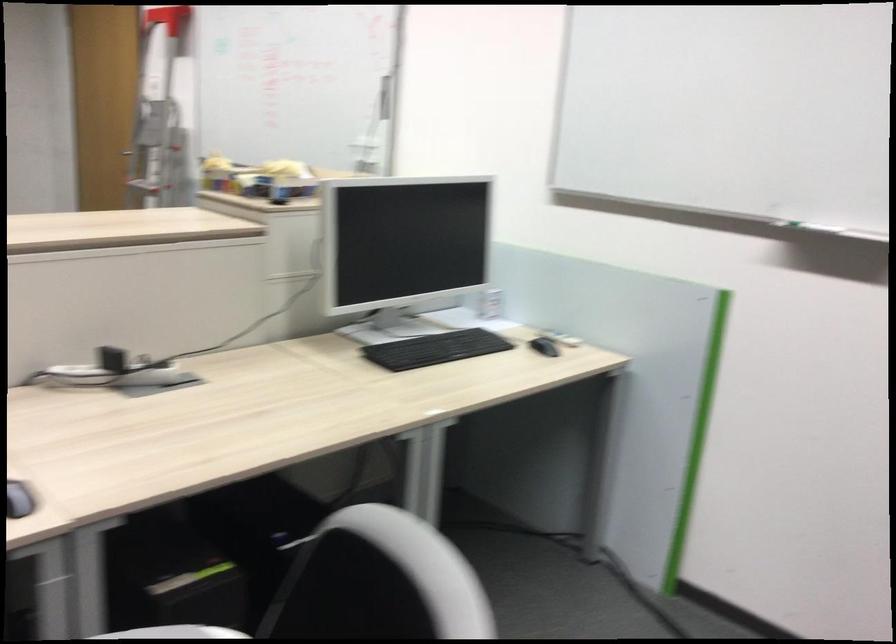
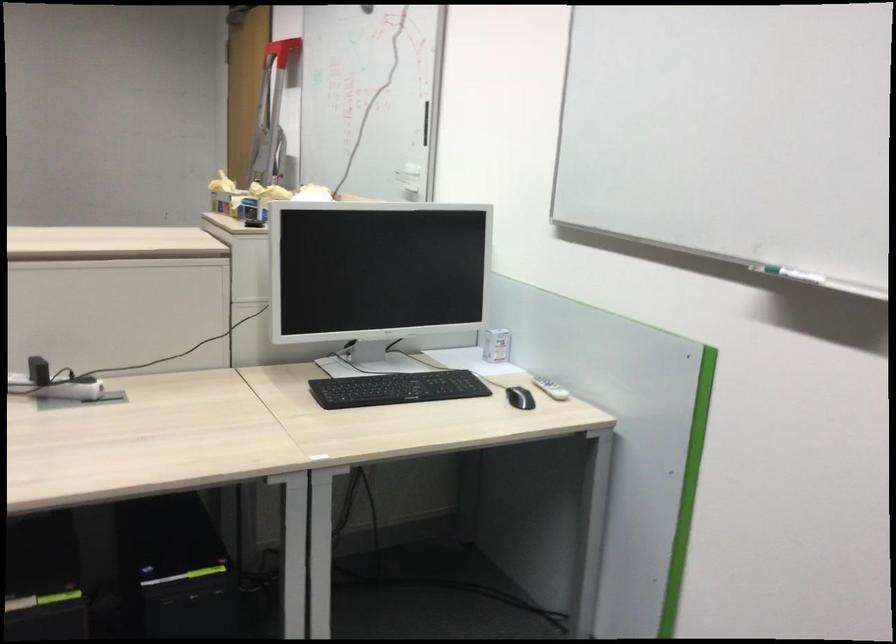
In a continuous first-person perspective shot, in which direction is the camera moving?

The cameraman moved toward right, forward.